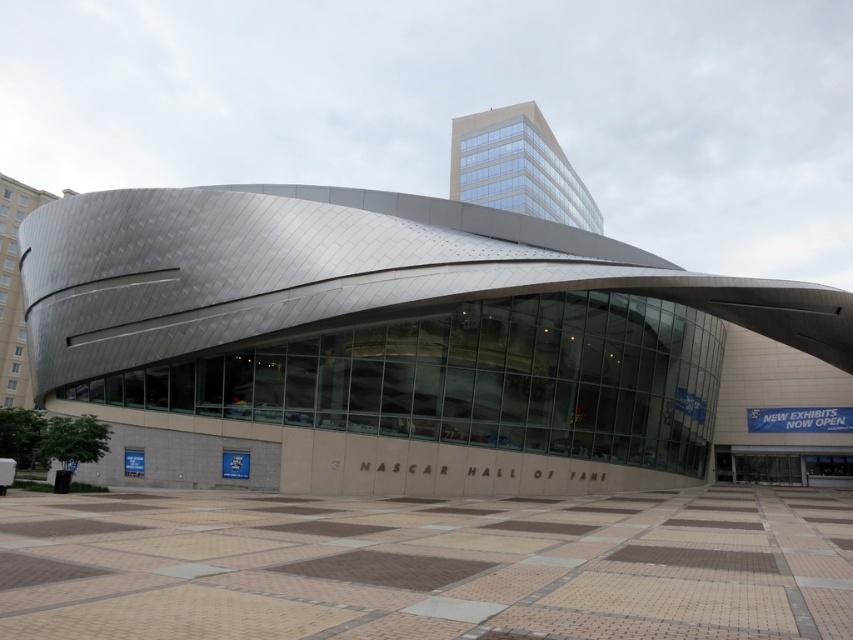
You are standing in front of the NASCAR Hall of Fame and want to take a photo of both the polished steel building at center and the glassy reflective building at upper center. Which one should you aim your camera at first to capture both in the frame?

You should aim your camera at the polished steel building at center first because it is located below the glassy reflective building at upper center, allowing both to be captured in the frame when positioned correctly.

You are standing in front of the NASCAR Hall of Fame and want to take a photo that includes both the polished steel building at center and the glassy reflective building at upper center. Which building should you position closer to the camera to ensure both are fully visible in the frame?

To ensure both the polished steel building at center and the glassy reflective building at upper center are fully visible in the frame, position the polished steel building at center closer to the camera since it is wider than the glassy reflective building at upper center.

You are standing at the entrance of the NASCAR Hall of Fame and want to locate two specific points marked on the plaza. The first point is at coordinates point (x=70, y=385) and the second is at point (x=573, y=205). From your vantage point at the entrance, which point is closer to you?

Point (x=70, y=385) is in front of point (x=573, y=205), so the first point is closer to you.